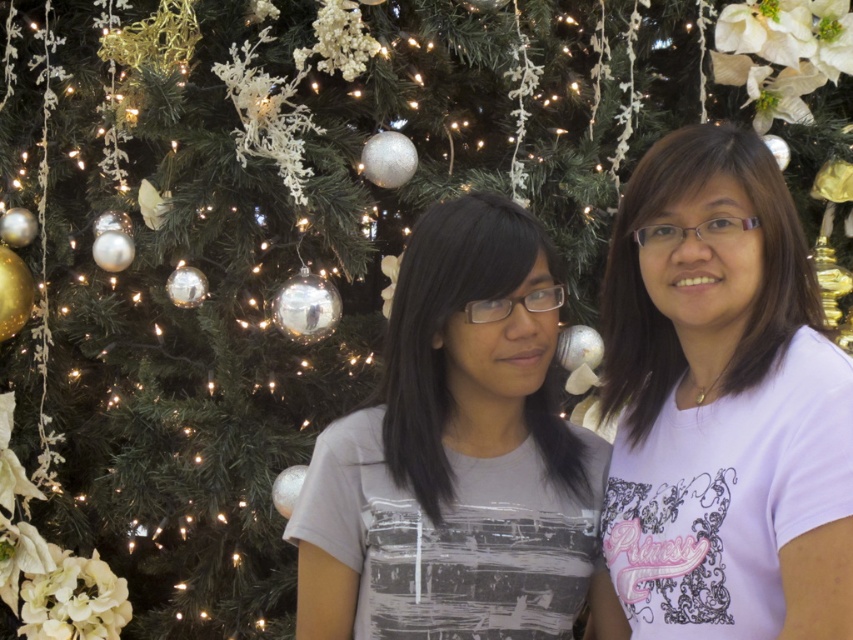
Who is positioned more to the right, white matte shirt at right or gray matte shirt at center?

Positioned to the right is white matte shirt at right.

Can you confirm if white matte shirt at right is bigger than gray matte shirt at center?

Correct, white matte shirt at right is larger in size than gray matte shirt at center.

Between point (669, 483) and point (315, 465), which one is positioned behind?

Positioned behind is point (315, 465).

Find the location of a particular element. The height and width of the screenshot is (640, 853). white matte shirt at right is located at coordinates (722, 403).